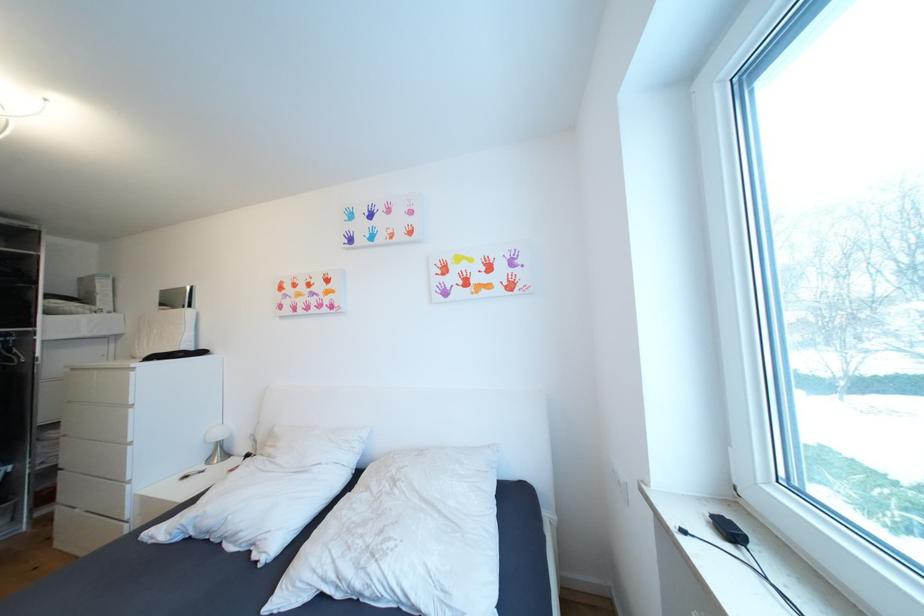
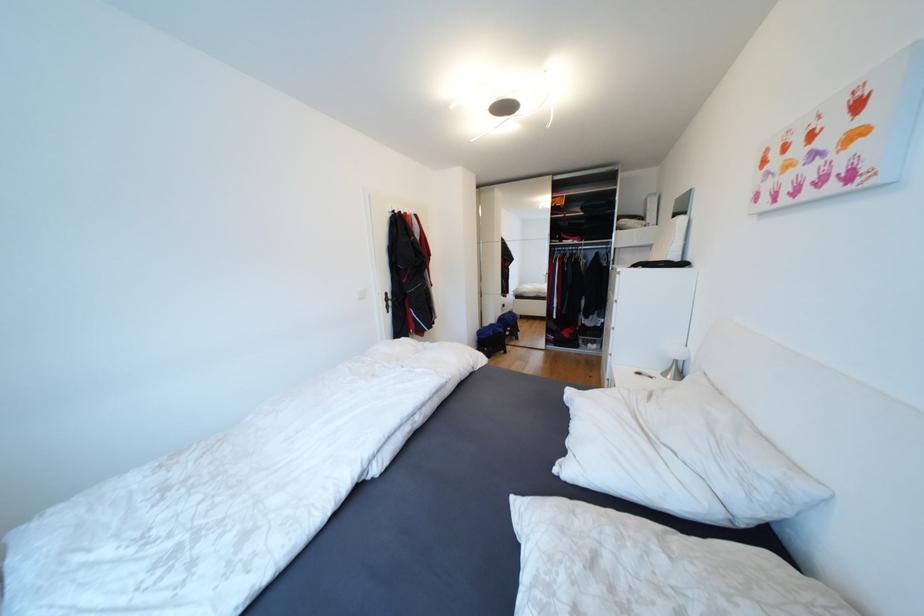
Question: I am providing you with two images of the same scene from different viewpoints. After the viewpoint changes to image2, which objects are now occluded?

Choices:
 (A) white light switch
 (B) black folding stool
 (C) white pillow
 (D) none of these

Answer: (D)